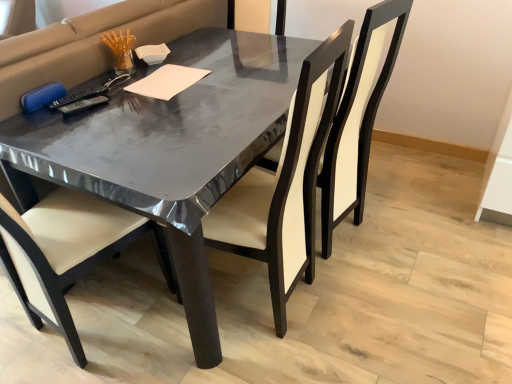
Question: From the image's perspective, is white paper at center positioned above or below matte black chair at center, acting as the 1th chair starting from the left?

Choices:
 (A) below
 (B) above

Answer: (B)

Question: In the image, is white paper at center on the left side or the right side of matte black chair at center, acting as the 1th chair starting from the left?

Choices:
 (A) right
 (B) left

Answer: (B)

Question: Estimate the real-world distances between objects in this image. Which object is closer to the white paper at center?

Choices:
 (A) matte black chair at center, the first chair positioned from the right
 (B) matte black chair at center, acting as the 1th chair starting from the left

Answer: (B)

Question: Based on their relative distances, which object is nearer to the matte black chair at center, acting as the 1th chair starting from the left?

Choices:
 (A) white paper at center
 (B) matte black chair at center, which ranks as the second chair in left-to-right order

Answer: (B)